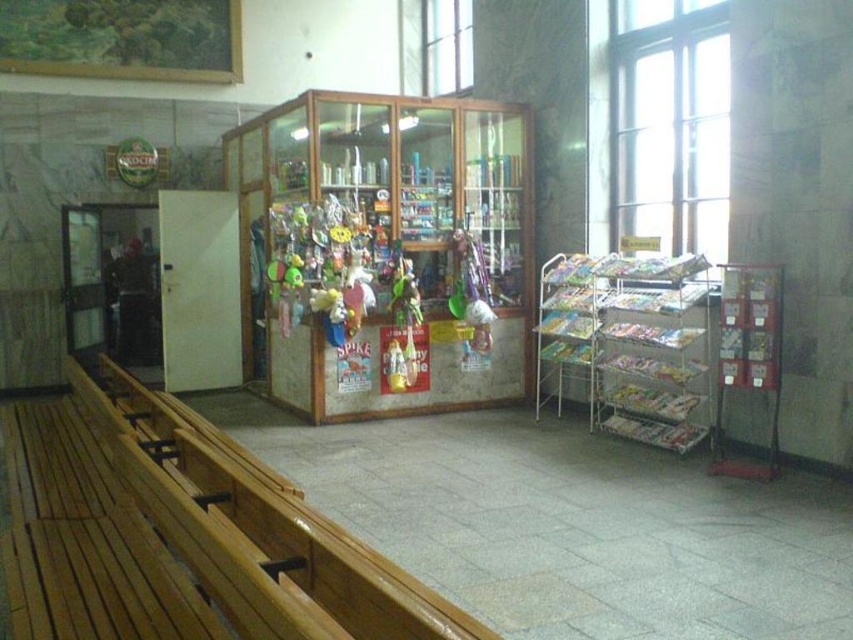
Is point (178, 435) more distant than point (397, 372)?

No, it is in front of (397, 372).

Who is lower down, wooden bench at left or shiny plastic action figure at center?

wooden bench at left

Is point (264, 556) in front of point (396, 380)?

Yes, it is in front of point (396, 380).

Where is `wooden bench at left`? The height and width of the screenshot is (640, 853). wooden bench at left is located at coordinates (183, 532).